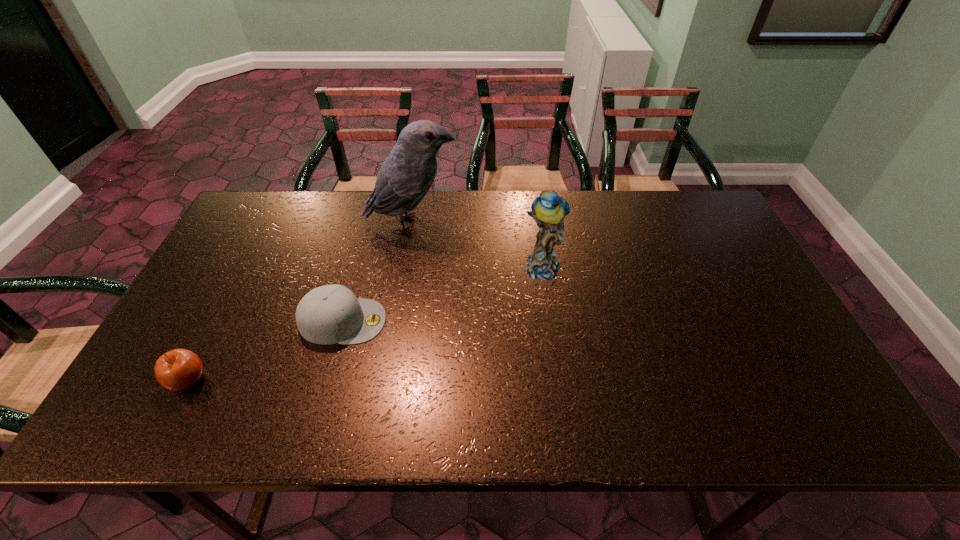
Locate an element on the screen. This screenshot has height=540, width=960. free space located on the back of the leftmost object is located at coordinates (234, 292).

The width and height of the screenshot is (960, 540). Identify the location of vacant space located on the front-facing side of the shortest object. (509, 321).

In order to click on object present at the far edge in this screenshot , I will do `click(405, 177)`.

The width and height of the screenshot is (960, 540). I want to click on object at the near edge, so click(x=179, y=369).

Find the location of `object that is at the left edge`. object that is at the left edge is located at coordinates (179, 369).

You are a GUI agent. You are given a task and a screenshot of the screen. Output one action in this format:
    pyautogui.click(x=<x>, y=<y>)
    Task: Click on the object located at the near left corner
    The image size is (960, 540).
    Given the screenshot: What is the action you would take?
    pyautogui.click(x=179, y=369)

This screenshot has width=960, height=540. In order to click on free space at the far edge in this screenshot , I will do `click(600, 200)`.

At what (x,y) coordinates should I click in order to perform the action: click on vacant region at the near edge of the desktop. Please return your answer as a coordinate pair (x, y). The image size is (960, 540). Looking at the image, I should click on (354, 432).

Image resolution: width=960 pixels, height=540 pixels. Find the location of `free space at the left edge of the desktop`. free space at the left edge of the desktop is located at coordinates (267, 248).

I want to click on vacant space at the right edge of the desktop, so click(731, 302).